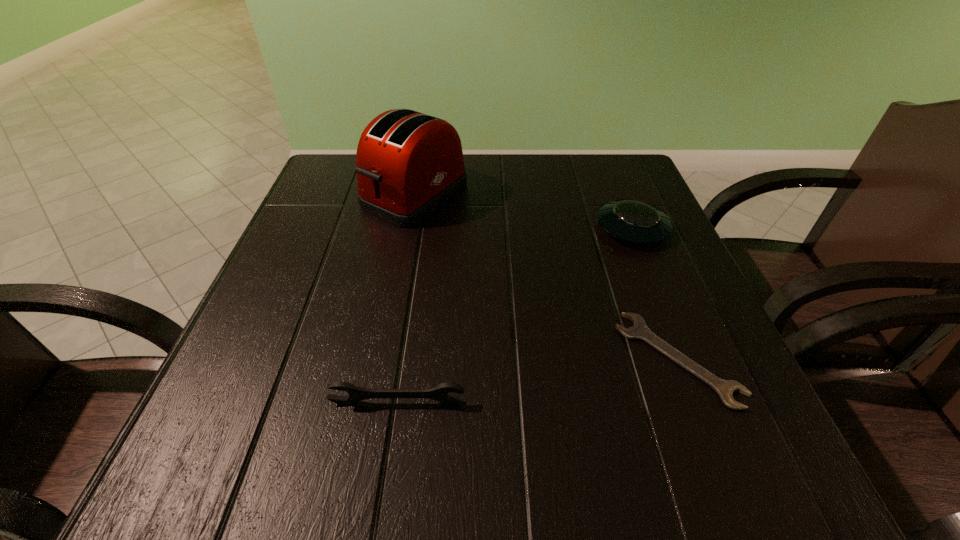
Where is `toaster`? This screenshot has height=540, width=960. toaster is located at coordinates (408, 164).

At what (x,y) coordinates should I click in order to perform the action: click on saucer. Please return your answer as a coordinate pair (x, y). Looking at the image, I should click on (633, 221).

The width and height of the screenshot is (960, 540). I want to click on the left wrench, so click(439, 392).

What are the coordinates of `the right wrench` in the screenshot? It's located at (639, 330).

Identify the location of the shorter wrench. (639, 330).

Locate an element on the screen. vacant region located 0.400m on the front of the tallest object is located at coordinates (377, 395).

This screenshot has width=960, height=540. In order to click on vacant area situated on the back of the saucer in this screenshot , I will do `click(602, 153)`.

This screenshot has width=960, height=540. I want to click on free space located on the open ends of the left wrench, so click(384, 491).

Identify the location of vacant point located on the left of the right wrench. The image size is (960, 540). (471, 359).

The image size is (960, 540). Find the location of `object that is at the far edge`. object that is at the far edge is located at coordinates (408, 164).